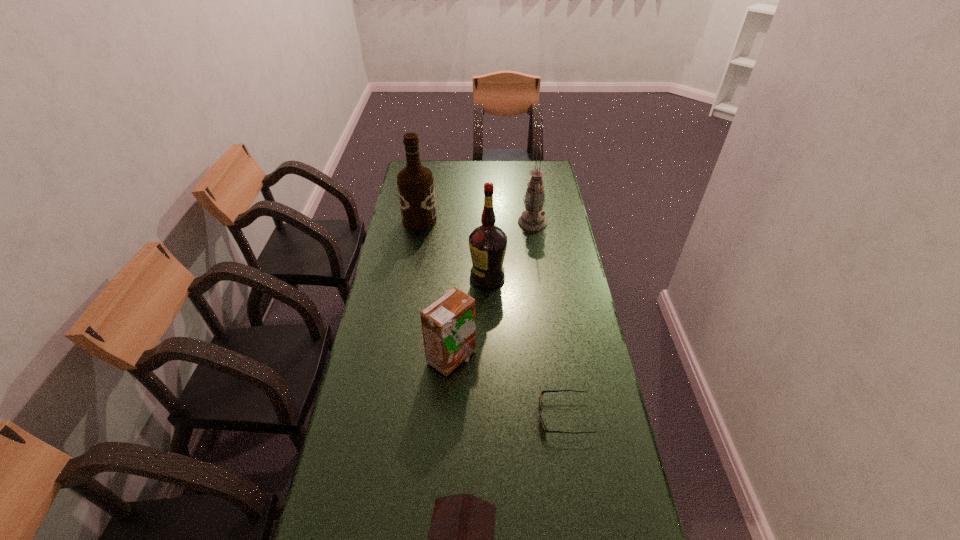
Find the location of a particular element. sunglasses present at the right edge is located at coordinates (542, 392).

Where is `free space at the far edge of the desktop`? free space at the far edge of the desktop is located at coordinates (466, 161).

I want to click on vacant area at the left edge of the desktop, so click(x=385, y=266).

The image size is (960, 540). In the image, there is a desktop. In order to click on free space at the right edge in this screenshot , I will do `click(553, 241)`.

Locate an element on the screen. This screenshot has height=540, width=960. free region at the far left corner of the desktop is located at coordinates (434, 165).

Image resolution: width=960 pixels, height=540 pixels. In the image, there is a desktop. In order to click on vacant space at the far right corner in this screenshot , I will do pyautogui.click(x=530, y=167).

You are a GUI agent. You are given a task and a screenshot of the screen. Output one action in this format:
    pyautogui.click(x=<x>, y=<y>)
    Task: Click on the free space between the oil lamp and the sunglasses
    
    Given the screenshot: What is the action you would take?
    pyautogui.click(x=548, y=319)

Where is `free space that is in between the oil lamp and the shortest object`? free space that is in between the oil lamp and the shortest object is located at coordinates pyautogui.click(x=548, y=319).

Find the location of a particular element. Image resolution: width=960 pixels, height=540 pixels. empty space that is in between the shortest object and the oil lamp is located at coordinates point(548,319).

You are a GUI agent. You are given a task and a screenshot of the screen. Output one action in this format:
    pyautogui.click(x=<x>, y=<y>)
    Task: Click on the free spot between the sunglasses and the fourth tallest object
    
    Given the screenshot: What is the action you would take?
    pyautogui.click(x=508, y=387)